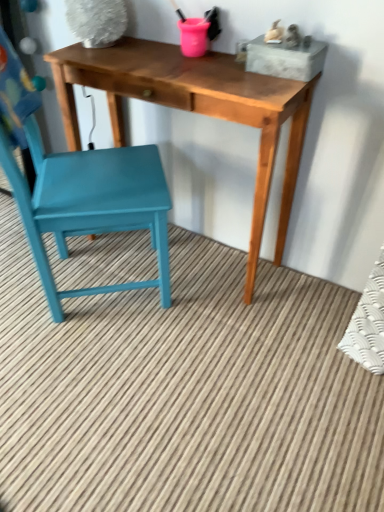
I want to click on free point in front of teal painted wood chair at left, so point(102,370).